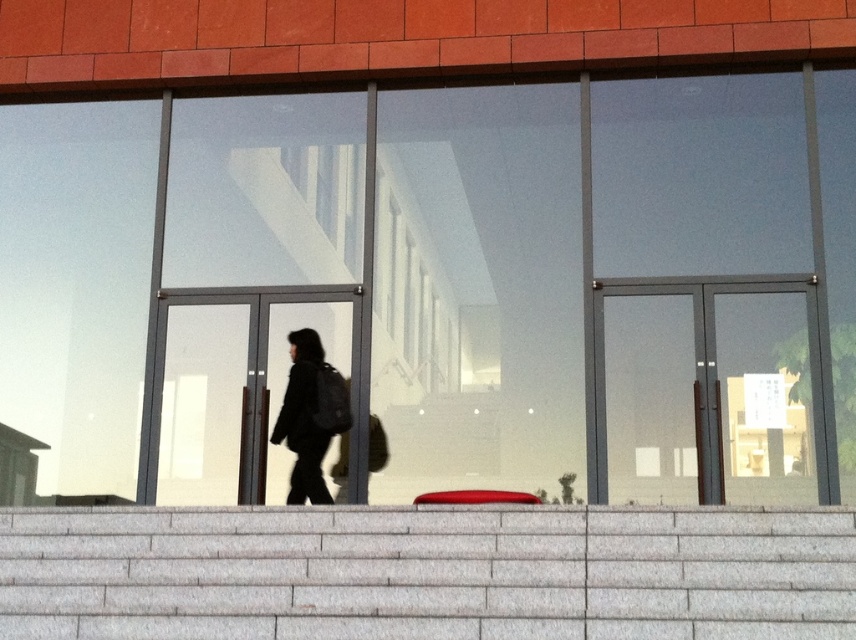
Who is lower down, gray stone stairs at lower center or black matte backpack at center?

Positioned lower is gray stone stairs at lower center.

Is point (45, 531) behind point (317, 339)?

No, it is in front of (317, 339).

Does point (313, 531) come farther from viewer compared to point (308, 406)?

No.

Locate an element on the screen. This screenshot has height=640, width=856. gray stone stairs at lower center is located at coordinates (428, 572).

Who is taller, transparent glass window at center or gray stone stairs at lower center?

Standing taller between the two is transparent glass window at center.

Is point (248, 179) farther from camera compared to point (519, 506)?

That is True.

The height and width of the screenshot is (640, 856). What do you see at coordinates (498, 280) in the screenshot? I see `transparent glass window at center` at bounding box center [498, 280].

Identify the location of transparent glass window at center. Image resolution: width=856 pixels, height=640 pixels. (498, 280).

Does transparent glass window at center appear under black matte backpack at center?

Incorrect, transparent glass window at center is not positioned below black matte backpack at center.

Is transparent glass window at center wider than black matte backpack at center?

Indeed, transparent glass window at center has a greater width compared to black matte backpack at center.

Which is in front, point (833, 461) or point (318, 500)?

Point (833, 461)

Locate an element on the screen. The height and width of the screenshot is (640, 856). transparent glass window at center is located at coordinates click(498, 280).